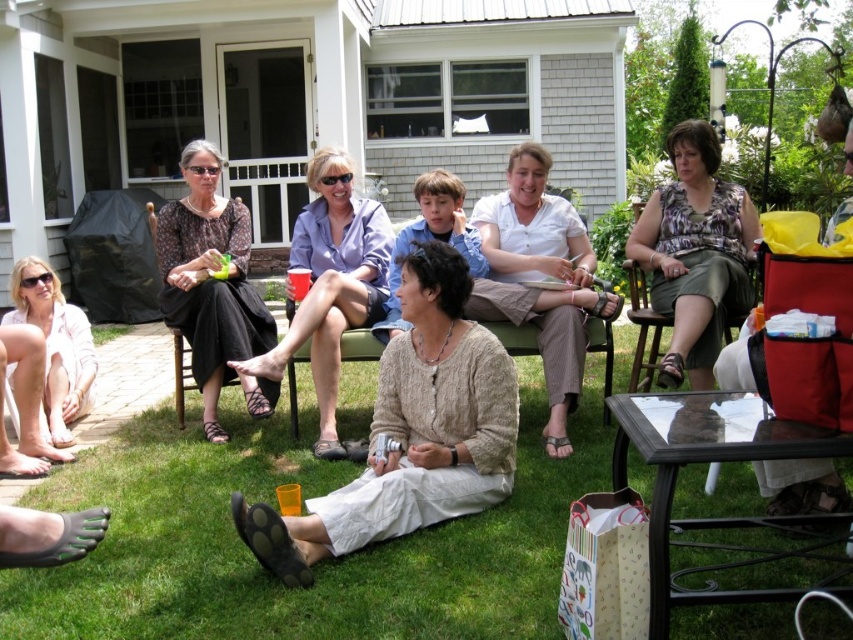
Can you confirm if white cotton shirt at center is taller than orange plastic cup at lower center?

Indeed, white cotton shirt at center has a greater height compared to orange plastic cup at lower center.

Between point (492, 282) and point (292, 483), which one is positioned in front?

Positioned in front is point (292, 483).

Image resolution: width=853 pixels, height=640 pixels. In order to click on white cotton shirt at center in this screenshot , I will do `click(540, 278)`.

The image size is (853, 640). What do you see at coordinates (410, 432) in the screenshot? I see `knitted beige sweater at center` at bounding box center [410, 432].

Consider the image. Who is more distant from viewer, (403, 435) or (357, 253)?

Positioned behind is point (357, 253).

Is point (407, 426) closer to camera compared to point (335, 292)?

Yes, point (407, 426) is in front of point (335, 292).

You are a GUI agent. You are given a task and a screenshot of the screen. Output one action in this format:
    pyautogui.click(x=<x>, y=<y>)
    Task: Click on the knitted beige sweater at center
    The height and width of the screenshot is (640, 853).
    Given the screenshot: What is the action you would take?
    coord(410,432)

Can you confirm if printed cotton blouse at center is shorter than pink cotton shirt at lower left?

No, printed cotton blouse at center is not shorter than pink cotton shirt at lower left.

Does printed cotton blouse at center have a greater height compared to pink cotton shirt at lower left?

Correct, printed cotton blouse at center is much taller as pink cotton shirt at lower left.

Identify the location of printed cotton blouse at center. (695, 253).